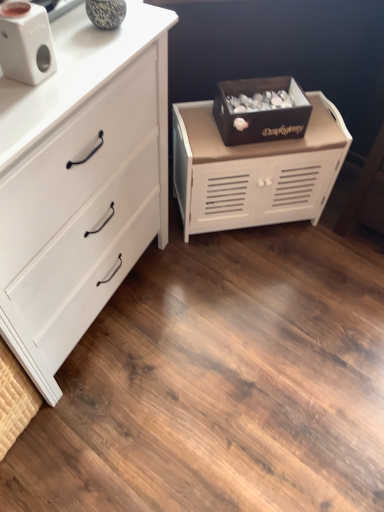
Identify the location of free space on the front side of white matte cabinet at center, the 2th chest of drawers from the left. The image size is (384, 512). (245, 281).